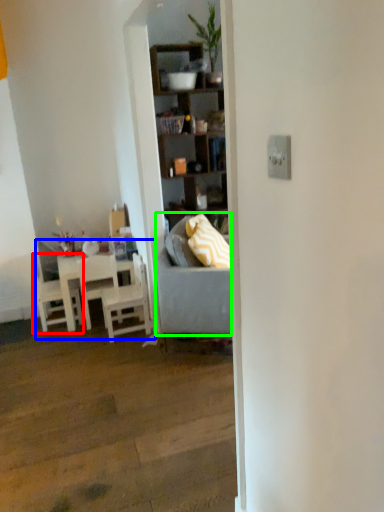
Question: Considering the real-world distances, which object is farthest from chair (highlighted by a red box)? kitchen & dining room table (highlighted by a blue box) or studio couch (highlighted by a green box)?

Choices:
 (A) kitchen & dining room table
 (B) studio couch

Answer: (B)